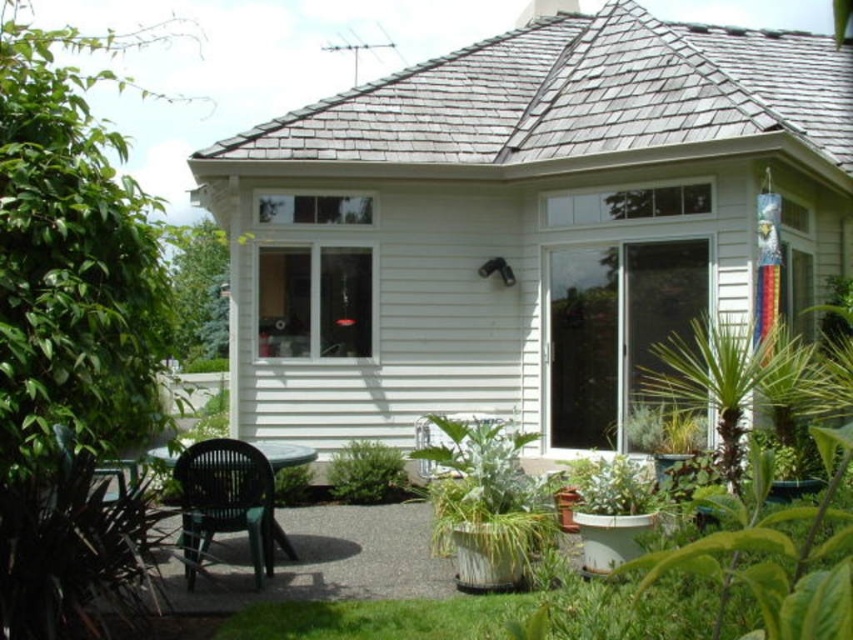
Question: Is black plastic chair at lower left smaller than green leafy plant at lower center?

Choices:
 (A) no
 (B) yes

Answer: (A)

Question: Does green leafy plant at center appear over green leafy plant at lower center?

Choices:
 (A) yes
 (B) no

Answer: (A)

Question: Which point is farther to the camera?

Choices:
 (A) green leafy plant at lower center
 (B) green leafy plant at center
 (C) white siding at center

Answer: (C)

Question: Does white siding at center appear under green metallic pot at lower center?

Choices:
 (A) no
 (B) yes

Answer: (A)

Question: Based on their relative distances, which object is nearer to the black plastic chair at lower left?

Choices:
 (A) white siding at center
 (B) green leafy plant at center
 (C) green leafy plant at lower center

Answer: (C)

Question: Which of the following is the closest to the observer?

Choices:
 (A) green metallic pot at lower center
 (B) black plastic chair at lower left
 (C) white siding at center

Answer: (B)